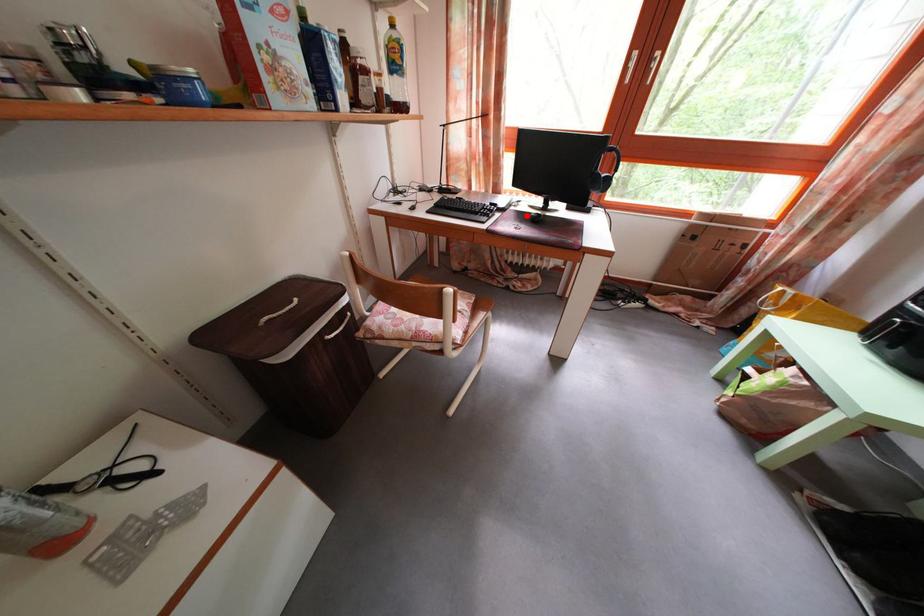
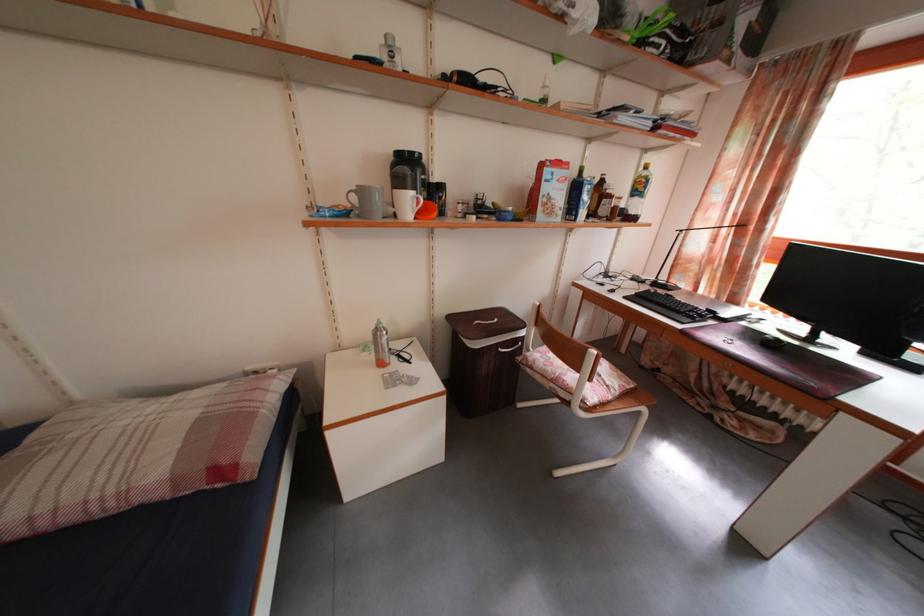
The point at the highlighted location is marked in the first image. Where is the corresponding point in the second image?

(763, 334)